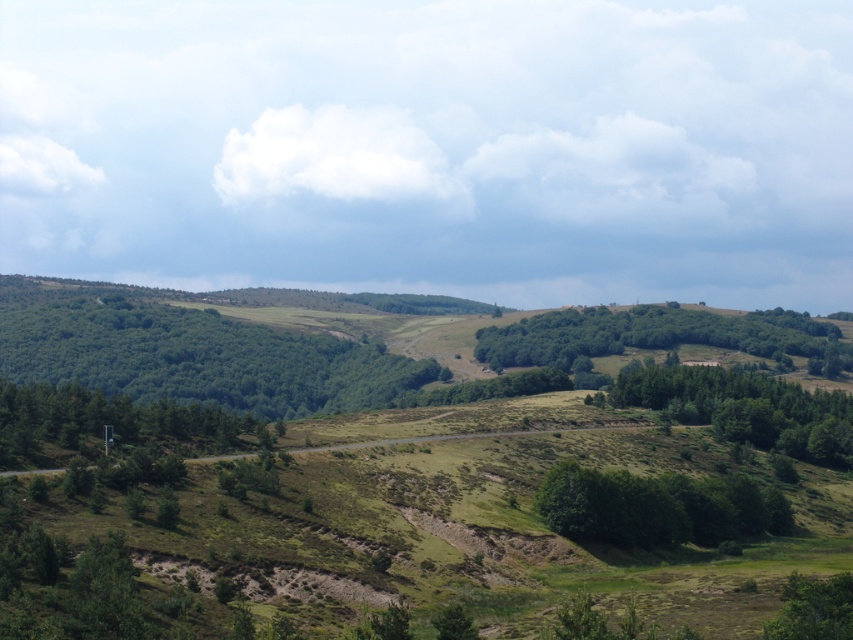
You are a hiker standing at the start of the winding road in the foreground. You see the green leafy tree at lower right and the green leafy tree at lower center. Which tree is closer to you?

The green leafy tree at lower right is closer to you because it is in front of the green leafy tree at lower center.

Based on the photo, you are a hiker standing at the start of the winding road in the foreground. You notice two green leafy trees ahead of you. The first is the green leafy tree at lower right, and the second is the green leafy tree at lower center. Which tree would appear larger in your field of view?

The green leafy tree at lower right is taller than the green leafy tree at lower center, so it would appear larger in your field of view.